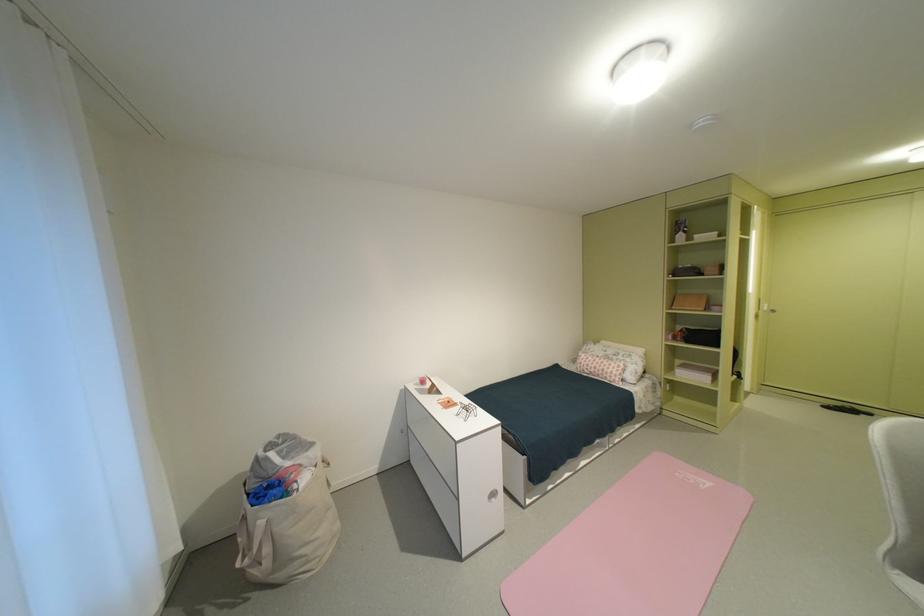
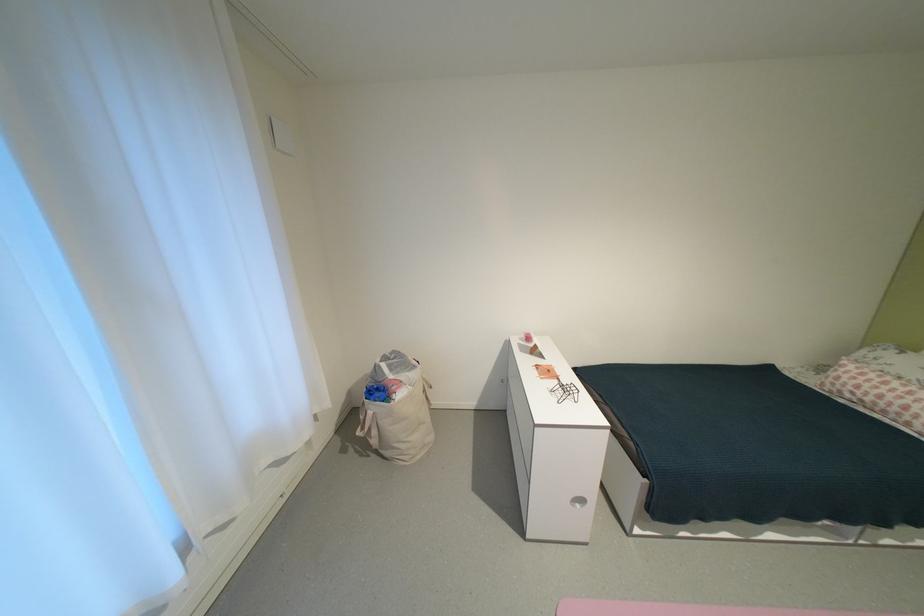
Find the pixel in the second image that matches [261,507] in the first image.

(375, 400)